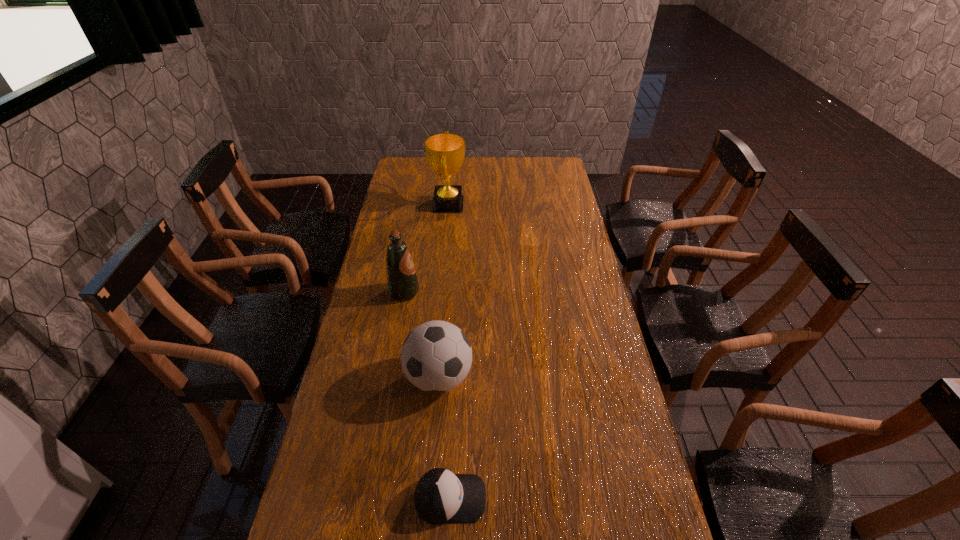
Find the location of `vacant space in between the second shortest object and the award`. vacant space in between the second shortest object and the award is located at coordinates (444, 291).

Locate an element on the screen. The image size is (960, 540). empty space that is in between the third farthest object and the award is located at coordinates (444, 291).

Locate an element on the screen. This screenshot has height=540, width=960. empty space between the second farthest object and the award is located at coordinates (426, 248).

Identify the location of free spot between the third farthest object and the shortest object. This screenshot has height=540, width=960. (444, 437).

This screenshot has height=540, width=960. I want to click on free spot between the award and the second nearest object, so tap(444, 291).

Identify the location of object that can be found as the second closest to the award. The image size is (960, 540). (436, 356).

Find the location of a particular element. The image size is (960, 540). object that stands as the second closest to the nearest object is located at coordinates (402, 282).

This screenshot has height=540, width=960. I want to click on free space that satisfies the following two spatial constraints: 1. on the front-facing side of the second nearest object; 2. on the left side of the olive oil, so click(x=389, y=377).

Locate an element on the screen. vacant region that satisfies the following two spatial constraints: 1. on the front-facing side of the award; 2. on the left side of the third farthest object is located at coordinates (432, 377).

Identify the location of free space that satisfies the following two spatial constraints: 1. on the front-facing side of the award; 2. on the left side of the third tallest object. Image resolution: width=960 pixels, height=540 pixels. (432, 377).